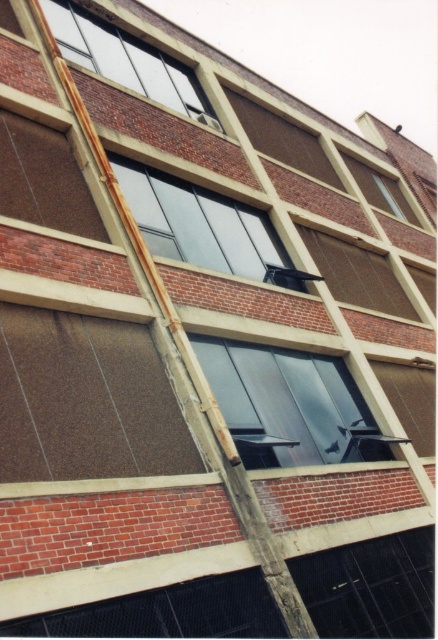
Can you confirm if matte black window at center is positioned above transparent glass window at lower right?

Correct, matte black window at center is located above transparent glass window at lower right.

Find the location of a particular element. The image size is (438, 640). matte black window at center is located at coordinates (289, 404).

Does point (317, 369) come in front of point (378, 592)?

No.

In order to click on matte black window at center in this screenshot , I will do `click(289, 404)`.

Locate an element on the screen. The image size is (438, 640). matte black window at center is located at coordinates (289, 404).

Which is more to the left, matte black window at center or transparent glass window at center?

Positioned to the left is transparent glass window at center.

I want to click on matte black window at center, so click(x=289, y=404).

Who is higher up, matte black window at center or clear glass window at upper right?

clear glass window at upper right is higher up.

Does matte black window at center have a lesser height compared to clear glass window at upper right?

In fact, matte black window at center may be taller than clear glass window at upper right.

Does point (286, 378) come farther from viewer compared to point (389, 209)?

That is False.

Find the location of a particular element. matte black window at center is located at coordinates (289, 404).